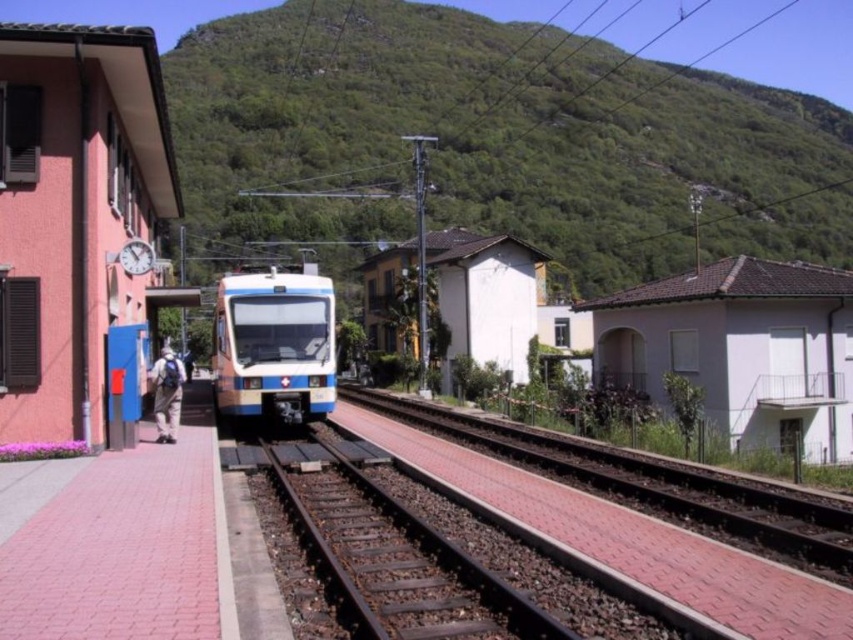
You are standing at the railway station and want to take a photo of both point [747,173] and point [425,429] in the scene. Since you can only focus on one point at a time, which point should you focus on to ensure both points are in focus?

You should focus on point [425,429] because it is closer to the camera than point [747,173]. By focusing on the closer point, the depth of field will likely include the farther point in focus as well.

You are a passenger waiting at the station and want to board the train. From your position on the platform, which direction should you look to first see the green leafy hillside at upper center and then the smooth concrete track at center?

You should first look upward to see the green leafy hillside at upper center, then look downward to see the smooth concrete track at center, since the hillside is above the track.

You are a photographer standing at the railway station platform. You want to capture a wide shot of the green leafy hillside at upper center and the khaki pants at left in your photo. Which object will occupy more horizontal space in the image?

The green leafy hillside at upper center will occupy more horizontal space in the image because its width is larger than that of the khaki pants at left.